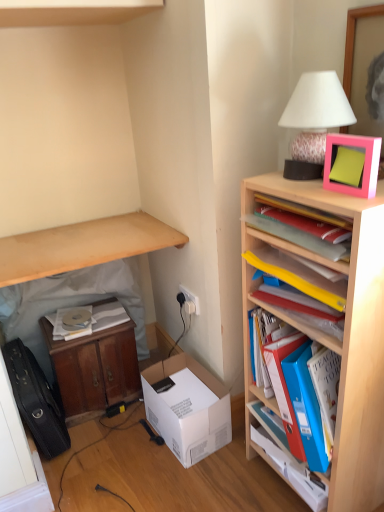
You are a GUI agent. You are given a task and a screenshot of the screen. Output one action in this format:
    pyautogui.click(x=<x>, y=<y>)
    Task: Click on the vacant area that is in front of wooden cabinet at lower left, positioned as the second table in right-to-left order
    
    Given the screenshot: What is the action you would take?
    pyautogui.click(x=118, y=457)